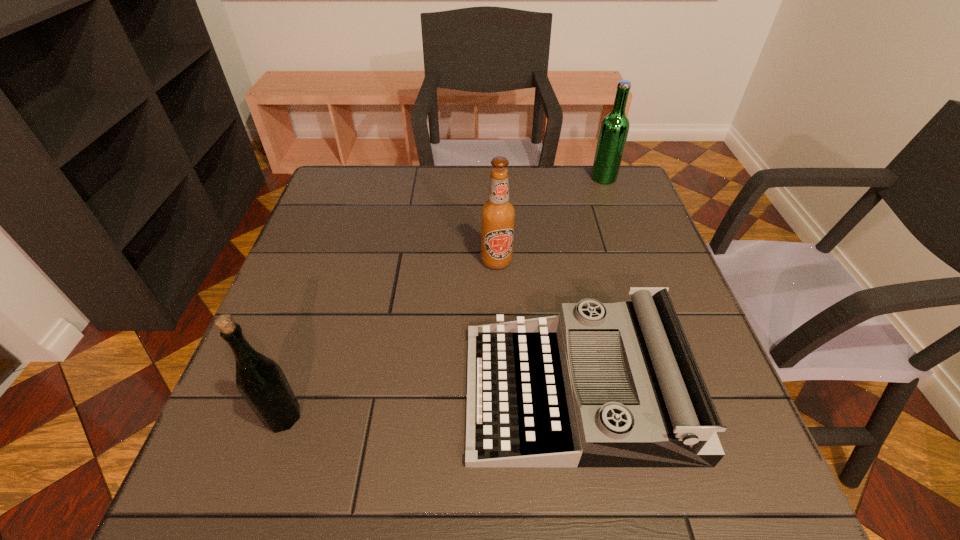
Where is `free area in between the leftmost object and the second farthest object`? free area in between the leftmost object and the second farthest object is located at coordinates (390, 339).

This screenshot has height=540, width=960. What are the coordinates of `free space between the leftmost beer bottle and the shortest object` in the screenshot? It's located at (430, 404).

Locate an element on the screen. The width and height of the screenshot is (960, 540). vacant area that lies between the second farthest beer bottle and the rightmost beer bottle is located at coordinates [x=550, y=219].

Locate which object ranks in proximity to the leftmost object. Please provide its 2D coordinates. Your answer should be formatted as a tuple, i.e. [(x, y)], where the tuple contains the x and y coordinates of a point satisfying the conditions above.

[(601, 384)]

Image resolution: width=960 pixels, height=540 pixels. I want to click on object that stands as the second closest to the shortest object, so click(x=261, y=381).

Where is `the closest beer bottle relative to the third nearest object`? This screenshot has width=960, height=540. the closest beer bottle relative to the third nearest object is located at coordinates (614, 129).

Identify which beer bottle is located as the second nearest to the rightmost beer bottle. Please provide its 2D coordinates. Your answer should be formatted as a tuple, i.e. [(x, y)], where the tuple contains the x and y coordinates of a point satisfying the conditions above.

[(261, 381)]

Locate an element on the screen. This screenshot has height=540, width=960. vacant space that satisfies the following two spatial constraints: 1. on the front side of the farthest object; 2. on the typing side of the typewriter is located at coordinates (681, 392).